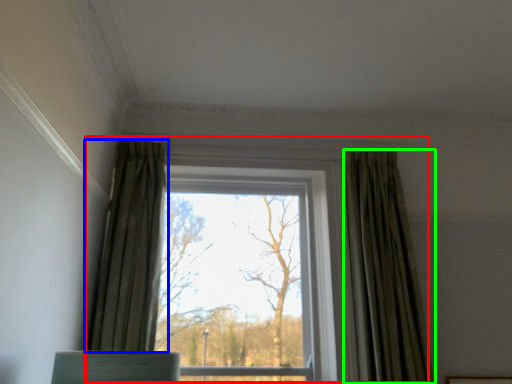
Question: Which object is positioned closest to window (highlighted by a red box)? Select from curtain (highlighted by a blue box) and curtain (highlighted by a green box).

Choices:
 (A) curtain
 (B) curtain

Answer: (B)